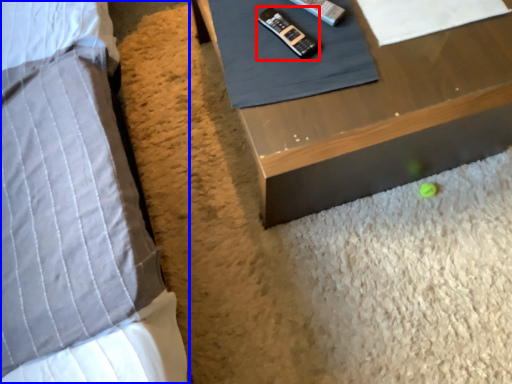
Question: Which point is closer to the camera, control (highlighted by a red box) or bed (highlighted by a blue box)?

Choices:
 (A) control
 (B) bed

Answer: (B)